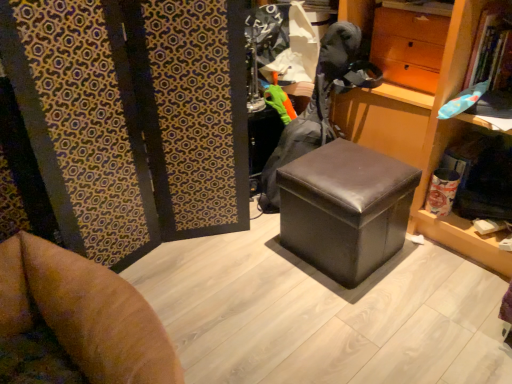
Question: Does matte brown drawer at upper right turn towards green fabric glove at center?

Choices:
 (A) yes
 (B) no

Answer: (B)

Question: Can you confirm if matte brown drawer at upper right is wider than green fabric glove at center?

Choices:
 (A) yes
 (B) no

Answer: (B)

Question: Does matte brown drawer at upper right come in front of green fabric glove at center?

Choices:
 (A) yes
 (B) no

Answer: (B)

Question: Is matte brown drawer at upper right next to green fabric glove at center and touching it?

Choices:
 (A) yes
 (B) no

Answer: (B)

Question: Can you confirm if matte brown drawer at upper right is smaller than green fabric glove at center?

Choices:
 (A) yes
 (B) no

Answer: (A)

Question: Does matte brown drawer at upper right have a lesser width compared to green fabric glove at center?

Choices:
 (A) yes
 (B) no

Answer: (A)

Question: Does matte brown drawer at upper right appear on the right side of black leather ottoman at center?

Choices:
 (A) yes
 (B) no

Answer: (A)

Question: Can you confirm if matte brown drawer at upper right is taller than black leather ottoman at center?

Choices:
 (A) no
 (B) yes

Answer: (A)

Question: From the image's perspective, would you say matte brown drawer at upper right is shown under black leather ottoman at center?

Choices:
 (A) no
 (B) yes

Answer: (A)

Question: Can you confirm if matte brown drawer at upper right is positioned to the left of black leather ottoman at center?

Choices:
 (A) yes
 (B) no

Answer: (B)

Question: Does matte brown drawer at upper right have a larger size compared to black leather ottoman at center?

Choices:
 (A) yes
 (B) no

Answer: (B)

Question: Could black leather ottoman at center be considered to be inside matte brown drawer at upper right?

Choices:
 (A) yes
 (B) no

Answer: (B)

Question: From the image's perspective, is green fabric glove at center located beneath matte brown drawer at upper right?

Choices:
 (A) no
 (B) yes

Answer: (B)